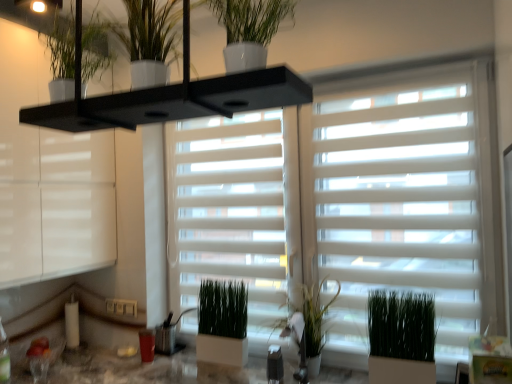
Question: From a real-world perspective, is white matte window blind at center above or below white glossy pot at upper center, the 4th houseplant from the bottom?

Choices:
 (A) above
 (B) below

Answer: (B)

Question: Relative to white glossy pot at upper center, the 4th houseplant from the bottom, is white matte window blind at center in front or behind?

Choices:
 (A) front
 (B) behind

Answer: (B)

Question: Which is farther from the green matte plant at center, which is the 3th houseplant in top-to-bottom order?

Choices:
 (A) green matte plant at center, the 1th houseplant ordered from the bottom
 (B) green matte plant at center, the 2th houseplant from the bottom
 (C) white matte window blind at center
 (D) white glossy pot at upper center, the first houseplant positioned from the front
 (E) white glossy window frame at upper left

Answer: (D)

Question: Based on their relative distances, which object is farther from the green matte plant at upper center, arranged as the fourth houseplant when viewed from the back?

Choices:
 (A) white glossy window frame at upper left
 (B) white glossy pot at upper center, which is the 2th houseplant from top to bottom
 (C) white matte window blind at center
 (D) green matte plant at center, the third houseplant in the back-to-front sequence
 (E) green matte plant at center, which is the 3th houseplant in top-to-bottom order

Answer: (D)